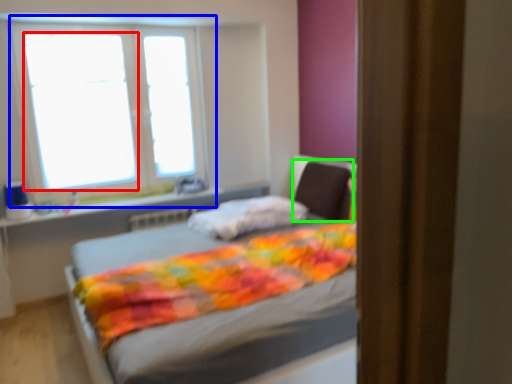
Question: Based on their relative distances, which object is nearer to window screen (highlighted by a red box)? Choose from window (highlighted by a blue box) and swivel chair (highlighted by a green box).

Choices:
 (A) window
 (B) swivel chair

Answer: (A)